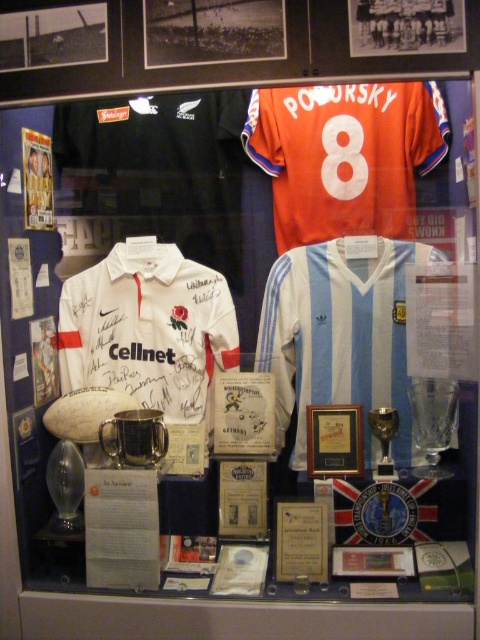
Looking at the display case, there are two items of interest the orange fabric number at upper center and the gold metallic trophy at center. Which one is positioned to the left of the other?

The orange fabric number at upper center is positioned to the left of the gold metallic trophy at center.

From the picture: You are a sports memorabilia curator examining the display case. You notice two orange items at the upper center of the display. What is the relationship between the orange jersey at upper center and the orange fabric number at upper center?

The orange jersey at upper center is positioned under orange fabric number at upper center.

You are a curator organizing a sports exhibition. You need to ensure that the matte gold plaque at center is visible to visitors. Is the orange jersey at upper center blocking it?

The orange jersey at upper center is positioned over matte gold plaque at center, so yes, it is blocking the plaque.